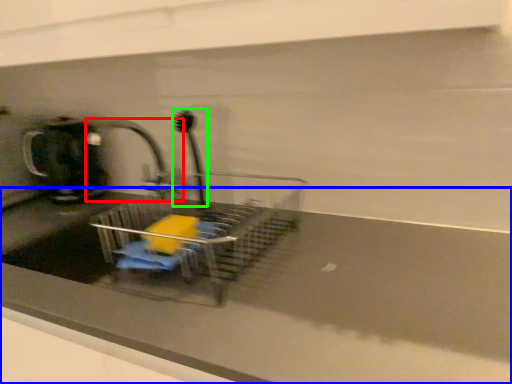
Question: Estimate the real-world distances between objects in this image. Which object is farther from tap (highlighted by a red box), counter top (highlighted by a blue box) or brush (highlighted by a green box)?

Choices:
 (A) counter top
 (B) brush

Answer: (A)